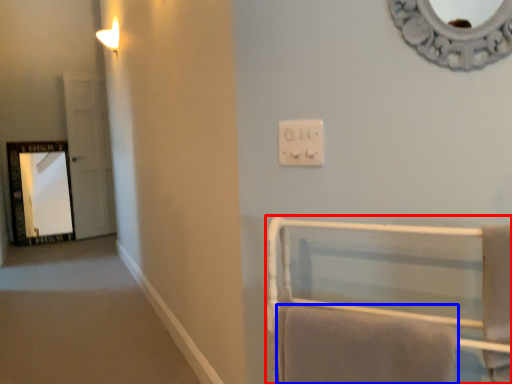
Question: Which object appears closest to the camera in this image, furniture (highlighted by a red box) or bath towel (highlighted by a blue box)?

Choices:
 (A) furniture
 (B) bath towel

Answer: (A)